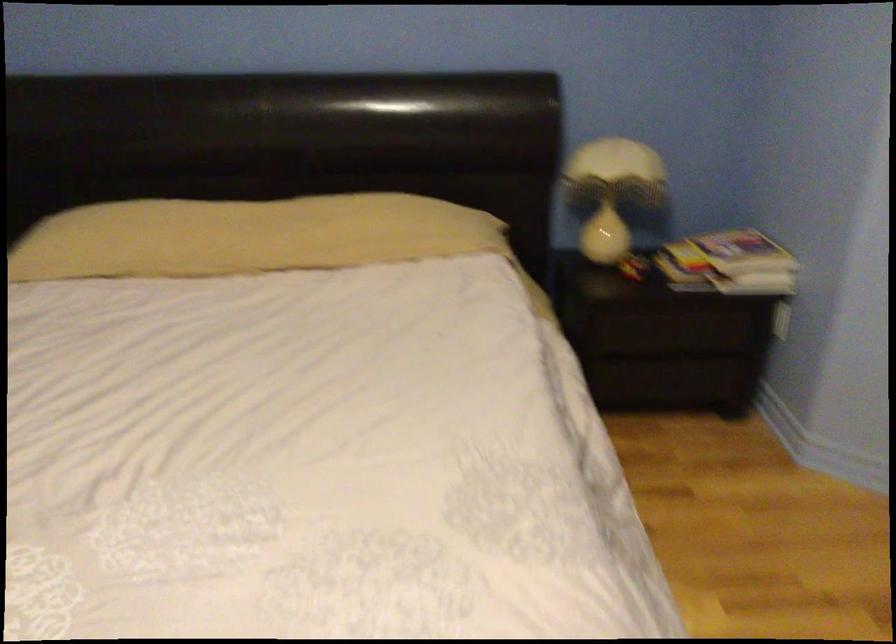
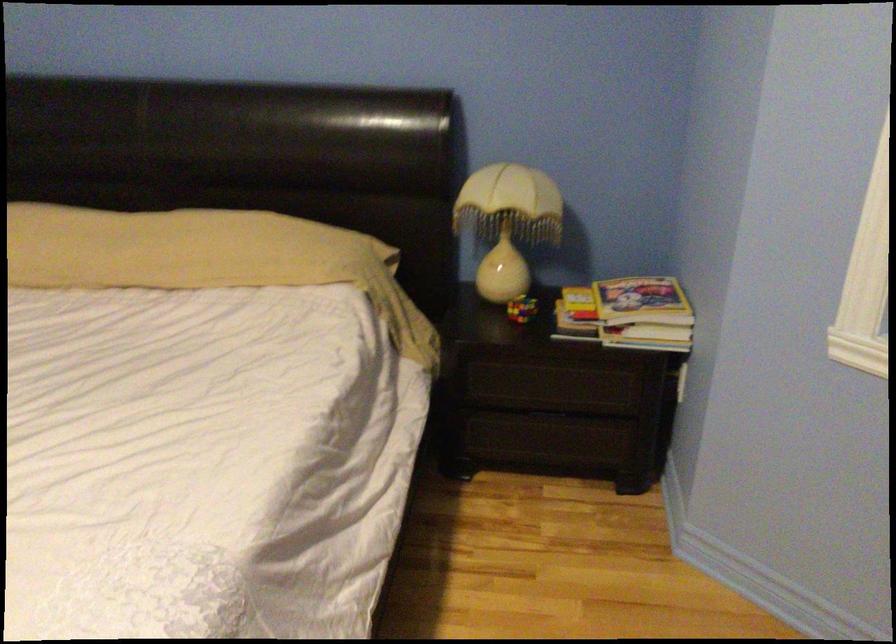
Locate, in the second image, the point that corresponds to (x=640, y=261) in the first image.

(521, 308)